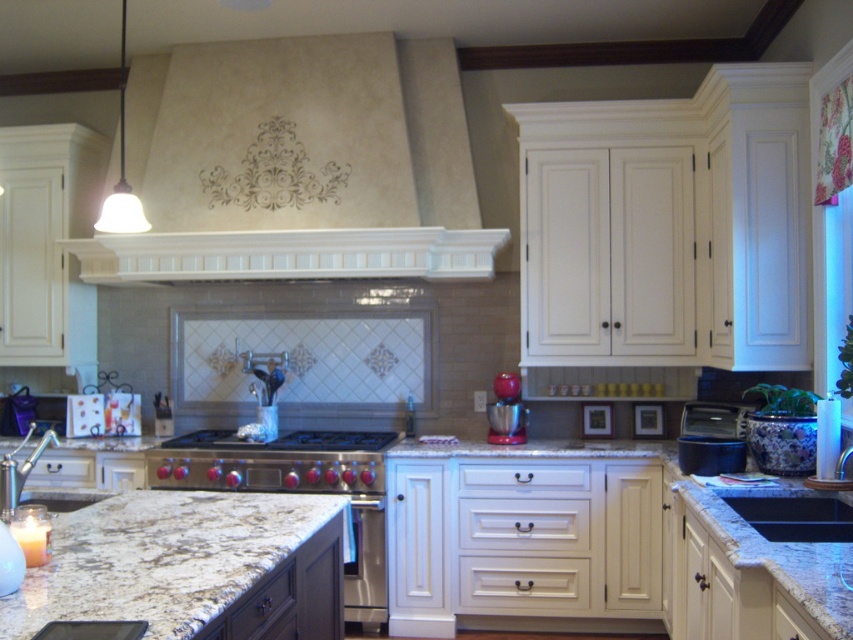
Can you confirm if stainless steel stove at center is positioned to the right of black granite sink at center?

No, stainless steel stove at center is not to the right of black granite sink at center.

Who is more distant from viewer, (306, 468) or (850, 522)?

The point (306, 468) is behind.

Which is in front, point (346, 460) or point (824, 516)?

Positioned in front is point (824, 516).

This screenshot has width=853, height=640. I want to click on stainless steel stove at center, so (271, 461).

Who is taller, stainless steel oven at center or black plastic toaster oven at lower right?

With more height is stainless steel oven at center.

Between stainless steel oven at center and black plastic toaster oven at lower right, which one appears on the left side from the viewer's perspective?

From the viewer's perspective, stainless steel oven at center appears more on the left side.

Is point (386, 442) farther from viewer compared to point (705, 422)?

Yes, point (386, 442) is farther from viewer.

You are a GUI agent. You are given a task and a screenshot of the screen. Output one action in this format:
    pyautogui.click(x=<x>, y=<y>)
    Task: Click on the stainless steel oven at center
    The image size is (853, 640).
    Given the screenshot: What is the action you would take?
    pyautogui.click(x=296, y=488)

Can you confirm if white marble countertop at center is bigger than stainless steel stove at center?

Yes.

The width and height of the screenshot is (853, 640). Find the location of `white marble countertop at center`. white marble countertop at center is located at coordinates (587, 540).